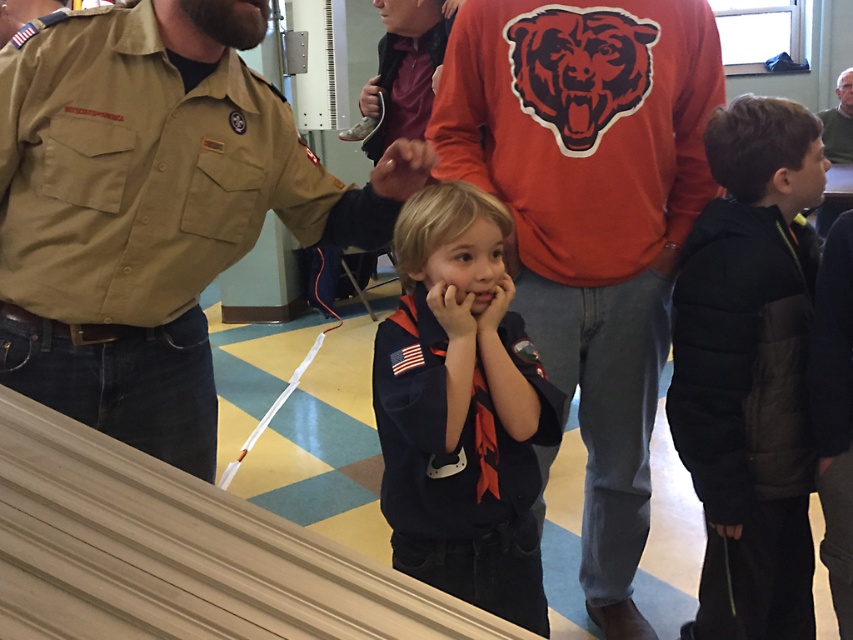
Question: Is orange jersey at center smaller than black puffy jacket at right?

Choices:
 (A) no
 (B) yes

Answer: (A)

Question: Which point appears farthest from the camera in this image?

Choices:
 (A) (515, 333)
 (B) (154, 38)
 (C) (833, 140)

Answer: (C)

Question: Where is khaki uniform shirt at center located in relation to orange jersey at center in the image?

Choices:
 (A) below
 (B) above

Answer: (B)

Question: Which object appears farthest from the camera in this image?

Choices:
 (A) navy blue uniform at center
 (B) khaki uniform shirt at center
 (C) orange jersey at center

Answer: (C)

Question: Which is farther from the navy blue uniform at center?

Choices:
 (A) black puffy jacket at right
 (B) orange jersey at center
 (C) khaki uniform shirt at center

Answer: (A)

Question: Is khaki uniform shirt at center bigger than gray knit sweater at upper right?

Choices:
 (A) no
 (B) yes

Answer: (B)